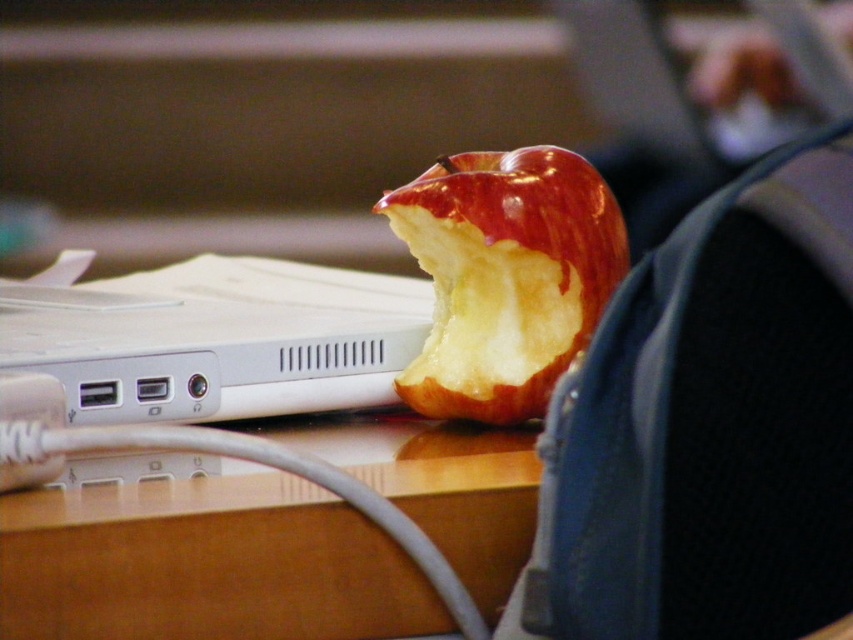
You are organizing a small snack area on the brown wood table at center and need to place a white plastic laptop at center. Considering the table size, will the laptop fit entirely on the table?

The brown wood table at center has a lesser width compared to white plastic laptop at center, so the laptop may not fit entirely on the table since the table is narrower than the laptop.

You are organizing items on a desk and need to place a white plastic laptop at center and a shiny red apple at center. Based on the scene, which item is positioned lower on the desk?

The white plastic laptop at center is located below the shiny red apple at center, so the laptop is positioned lower on the desk.